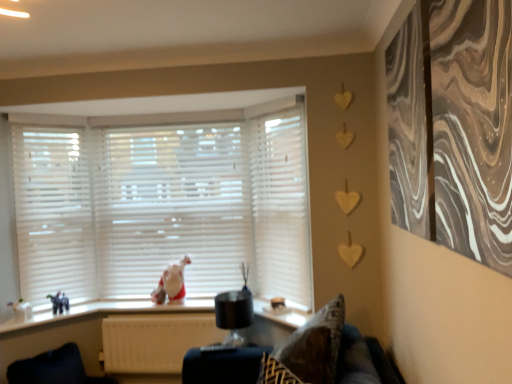
Question: Are velvet dark blue swivel chair at lower left and white matte blinds at center located far from each other?

Choices:
 (A) yes
 (B) no

Answer: (A)

Question: Is velvet dark blue swivel chair at lower left aimed at white matte blinds at center?

Choices:
 (A) yes
 (B) no

Answer: (B)

Question: From the image's perspective, would you say velvet dark blue swivel chair at lower left is shown under white matte blinds at center?

Choices:
 (A) yes
 (B) no

Answer: (A)

Question: Does velvet dark blue swivel chair at lower left have a smaller size compared to white matte blinds at center?

Choices:
 (A) no
 (B) yes

Answer: (B)

Question: From a real-world perspective, is velvet dark blue swivel chair at lower left positioned over white matte blinds at center based on gravity?

Choices:
 (A) no
 (B) yes

Answer: (A)

Question: In the image, is velvet dark blue swivel chair at lower left positioned in front of or behind white glossy vase at lower left?

Choices:
 (A) behind
 (B) front

Answer: (B)

Question: Would you say velvet dark blue swivel chair at lower left is inside or outside white glossy vase at lower left?

Choices:
 (A) inside
 (B) outside

Answer: (B)

Question: From the image's perspective, relative to white glossy vase at lower left, is velvet dark blue swivel chair at lower left above or below?

Choices:
 (A) below
 (B) above

Answer: (A)

Question: Considering the positions of point (56, 349) and point (24, 309), is point (56, 349) closer or farther from the camera than point (24, 309)?

Choices:
 (A) closer
 (B) farther

Answer: (B)

Question: Considering the relative positions of white matte blinds at left and white matte blinds at center, the second curtain viewed from the front, in the image provided, is white matte blinds at left to the left or to the right of white matte blinds at center, the second curtain viewed from the front,?

Choices:
 (A) right
 (B) left

Answer: (B)

Question: Choose the correct answer: Is white matte blinds at left inside white matte blinds at center, the second curtain viewed from the front, or outside it?

Choices:
 (A) inside
 (B) outside

Answer: (B)

Question: Relative to white matte blinds at center, the first curtain in the left-to-right sequence, is white matte blinds at left in front or behind?

Choices:
 (A) behind
 (B) front

Answer: (A)

Question: Is white matte blinds at left bigger or smaller than white matte blinds at center, the second curtain viewed from the front?

Choices:
 (A) small
 (B) big

Answer: (A)

Question: Considering the positions of white glossy vase at lower left and white matte radiator at lower center in the image, is white glossy vase at lower left wider or thinner than white matte radiator at lower center?

Choices:
 (A) wide
 (B) thin

Answer: (A)

Question: Is white glossy vase at lower left bigger or smaller than white matte radiator at lower center?

Choices:
 (A) big
 (B) small

Answer: (B)